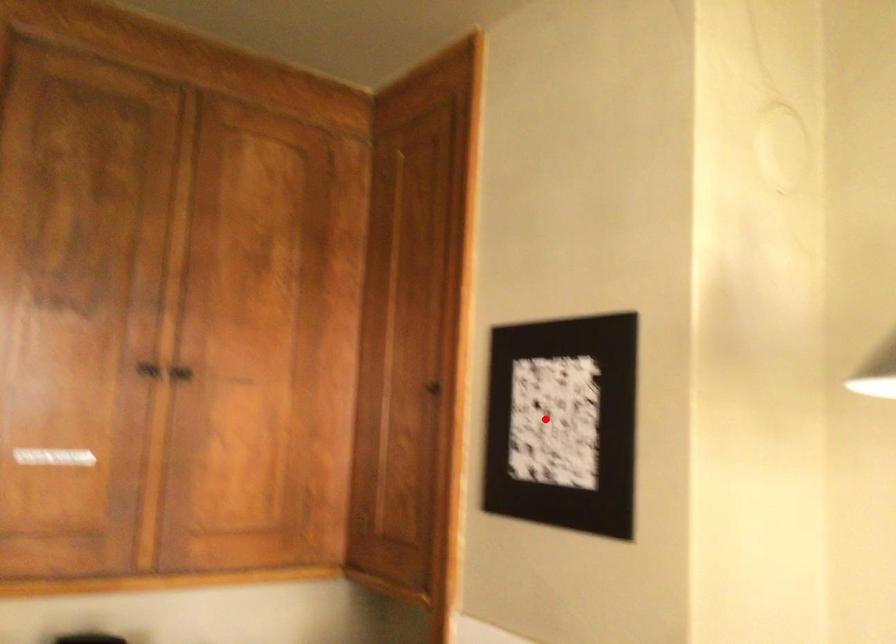
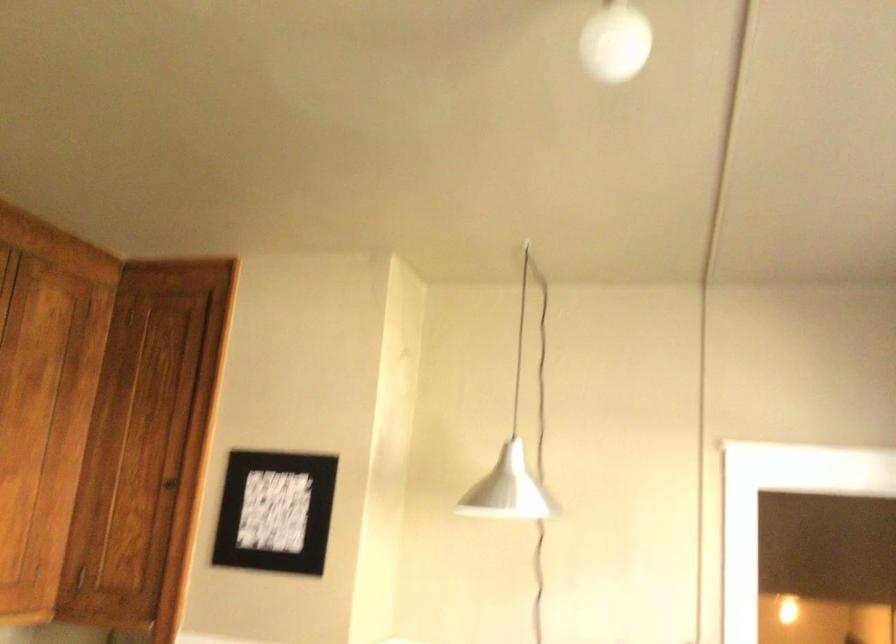
Question: I am providing you with two images of the same scene from different viewpoints. A red point is shown in image1. For the corresponding object point in image2, is it positioned nearer or farther from the camera?

Choices:
 (A) Nearer
 (B) Farther

Answer: (B)